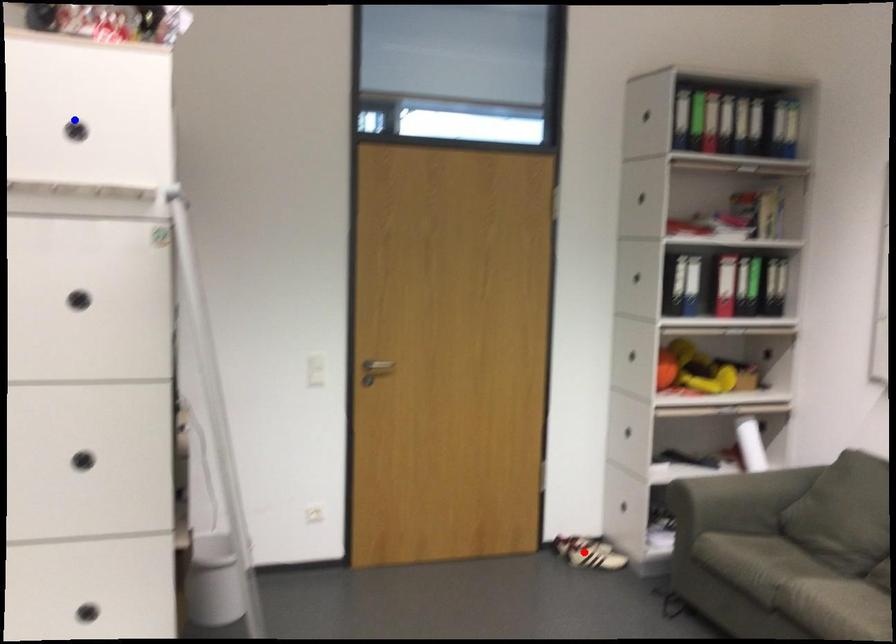
Question: In the image, two points are highlighted. Which point is nearer to the camera? Reply with the corresponding letter.

Choices:
 (A) blue point
 (B) red point

Answer: (A)